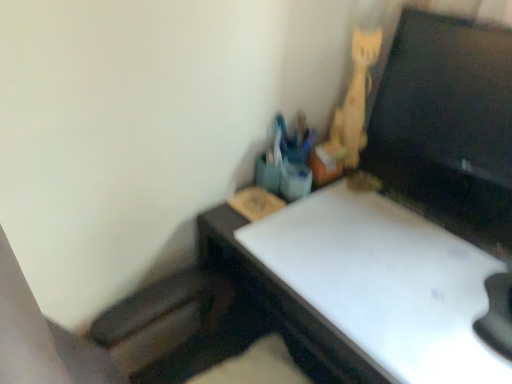
Question: Would you say black glossy monitor at upper right is inside or outside wooden cat at upper right?

Choices:
 (A) outside
 (B) inside

Answer: (A)

Question: Based on their sizes in the image, would you say black glossy monitor at upper right is bigger or smaller than wooden cat at upper right?

Choices:
 (A) small
 (B) big

Answer: (B)

Question: Considering the relative positions of black glossy monitor at upper right and wooden cat at upper right in the image provided, is black glossy monitor at upper right to the left or to the right of wooden cat at upper right?

Choices:
 (A) right
 (B) left

Answer: (A)

Question: Is wooden cat at upper right wider or thinner than black glossy monitor at upper right?

Choices:
 (A) wide
 (B) thin

Answer: (A)

Question: Is wooden cat at upper right in front of or behind black glossy monitor at upper right in the image?

Choices:
 (A) front
 (B) behind

Answer: (B)

Question: From their relative heights in the image, would you say wooden cat at upper right is taller or shorter than black glossy monitor at upper right?

Choices:
 (A) short
 (B) tall

Answer: (B)

Question: From a real-world perspective, is wooden cat at upper right positioned above or below black glossy monitor at upper right?

Choices:
 (A) above
 (B) below

Answer: (B)